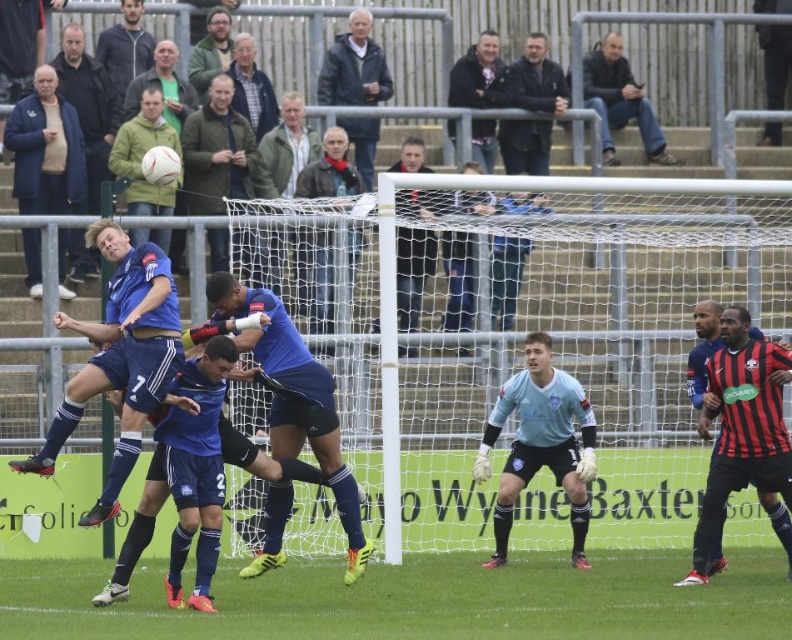
You are a soccer coach analyzing the players on the field. You notice two players wearing jackets. Which jacket has a smaller width? The jackets are the dark blue jacket at upper center and the dark brown leather jacket at upper right.

The dark blue jacket at upper center has a smaller width than the dark brown leather jacket at upper right.

You are a soccer coach analyzing the play. You notice the green textured jacket at center and the dark blue jacket at upper center. Which player is positioned higher in the image?

The dark blue jacket at upper center is positioned higher in the image.